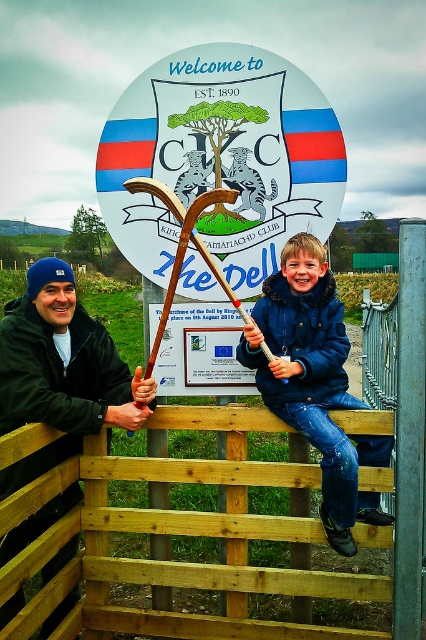
You are a photographer trying to capture a photo of the two people in the scene. The camera you are using has a limited focus range. If you focus on the blue fuzzy jacket at upper center, will the dark blue knit cap at left also be in focus?

The dark blue knit cap at left is wider than the blue fuzzy jacket at upper center, so if you focus on the blue fuzzy jacket at upper center, the dark blue knit cap at left will also be in focus because it is wider and likely within the same focus range.

You are standing at the entrance of The Dell and want to take a photo of the large circular sign in the background. However, there is a yellow wooden fence at center and a dark blue knit cap at left in your way. Which object is closer to you, blocking your view of the sign?

The yellow wooden fence at center is closer to you than the dark blue knit cap at left, so it is blocking your view of the sign.